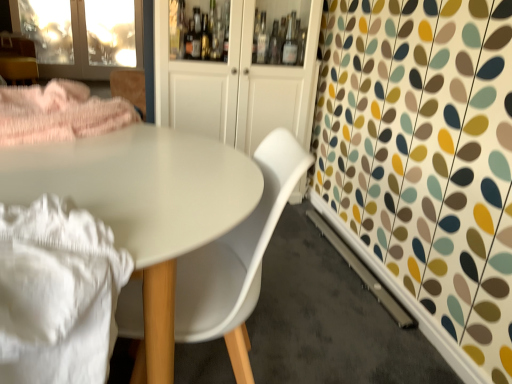
This screenshot has width=512, height=384. Identify the location of vacant area that lies to the right of white matte chair at center. (325, 353).